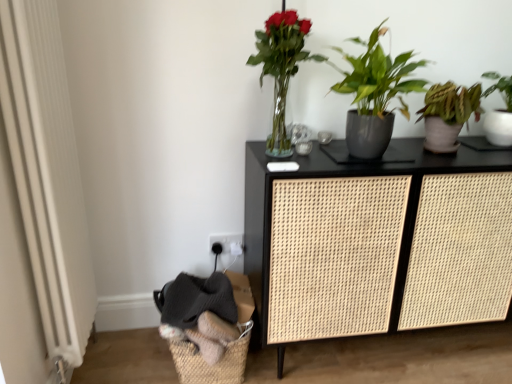
Describe the element at coordinates (47, 172) in the screenshot. I see `white textured radiator at left` at that location.

Locate an element on the screen. The height and width of the screenshot is (384, 512). white textured radiator at left is located at coordinates (47, 172).

What is the approximate height of matte gray pot at center right, which is counted as the 2th houseplant, starting from the left?

The height of matte gray pot at center right, which is counted as the 2th houseplant, starting from the left, is 17.68 inches.

What do you see at coordinates (214, 364) in the screenshot? I see `woven natural basket at lower left` at bounding box center [214, 364].

This screenshot has height=384, width=512. In order to click on black rattan cabinet at center in this screenshot , I will do `click(371, 243)`.

Locate an element on the screen. white textured radiator at left is located at coordinates (47, 172).

Considering the relative positions of translucent glass vase at upper center, which is counted as the third houseplant, starting from the right, and green matte plant at right, which appears as the third houseplant when viewed from the left, in the image provided, is translucent glass vase at upper center, which is counted as the third houseplant, starting from the right, to the right of green matte plant at right, which appears as the third houseplant when viewed from the left, from the viewer's perspective?

No.

Which is behind, translucent glass vase at upper center, which is counted as the third houseplant, starting from the right, or green matte plant at right, positioned as the first houseplant in right-to-left order?

green matte plant at right, positioned as the first houseplant in right-to-left order, is behind.

Considering the sizes of objects white textured radiator at left and woven natural basket at lower left in the image provided, who is bigger, white textured radiator at left or woven natural basket at lower left?

Bigger between the two is white textured radiator at left.

From the image's perspective, between white textured radiator at left and woven natural basket at lower left, who is located below?

woven natural basket at lower left appears lower in the image.

Is white textured radiator at left far away from woven natural basket at lower left?

white textured radiator at left is near woven natural basket at lower left, not far away.

From the image's perspective, is translucent glass vase at upper center, which is counted as the third houseplant, starting from the right, below woven natural basket at lower left?

Incorrect, from the image's perspective, translucent glass vase at upper center, which is counted as the third houseplant, starting from the right, is higher than woven natural basket at lower left.

Looking at the image, does translucent glass vase at upper center, which ranks as the first houseplant in left-to-right order, seem bigger or smaller compared to woven natural basket at lower left?

In the image, translucent glass vase at upper center, which ranks as the first houseplant in left-to-right order, appears to be smaller than woven natural basket at lower left.

Find the location of a particular element. The width and height of the screenshot is (512, 384). basket behind the translucent glass vase at upper center, which ranks as the first houseplant in left-to-right order is located at coordinates (214, 364).

Is translucent glass vase at upper center, which ranks as the first houseplant in left-to-right order, situated inside woven natural basket at lower left or outside?

translucent glass vase at upper center, which ranks as the first houseplant in left-to-right order, exists outside the volume of woven natural basket at lower left.

From a real-world perspective, which is physically below, green matte plant at right, which appears as the third houseplant when viewed from the left, or white textured radiator at left?

white textured radiator at left.

Is green matte plant at right, positioned as the first houseplant in right-to-left order, far from white textured radiator at left?

That's right, there is a large distance between green matte plant at right, positioned as the first houseplant in right-to-left order, and white textured radiator at left.

Is green matte plant at right, positioned as the first houseplant in right-to-left order, facing away from white textured radiator at left?

That's not correct — green matte plant at right, positioned as the first houseplant in right-to-left order, is not looking away from white textured radiator at left.

Considering the positions of objects green matte plant at right, positioned as the first houseplant in right-to-left order, and white textured radiator at left in the image provided, who is in front, green matte plant at right, positioned as the first houseplant in right-to-left order, or white textured radiator at left?

Positioned in front is white textured radiator at left.

From a real-world perspective, is matte gray pot at center right, positioned as the 2th houseplant in right-to-left order, beneath green matte plant at right, which appears as the third houseplant when viewed from the left?

No, from a real-world perspective, matte gray pot at center right, positioned as the 2th houseplant in right-to-left order, is not below green matte plant at right, which appears as the third houseplant when viewed from the left.

Is matte gray pot at center right, positioned as the 2th houseplant in right-to-left order, situated inside green matte plant at right, which appears as the third houseplant when viewed from the left, or outside?

matte gray pot at center right, positioned as the 2th houseplant in right-to-left order, exists outside the volume of green matte plant at right, which appears as the third houseplant when viewed from the left.

Considering the positions of objects matte gray pot at center right, positioned as the 2th houseplant in right-to-left order, and green matte plant at right, which appears as the third houseplant when viewed from the left, in the image provided, who is in front, matte gray pot at center right, positioned as the 2th houseplant in right-to-left order, or green matte plant at right, which appears as the third houseplant when viewed from the left,?

matte gray pot at center right, positioned as the 2th houseplant in right-to-left order, is more forward.

Between matte gray pot at center right, which is counted as the 2th houseplant, starting from the left, and green matte plant at right, positioned as the first houseplant in right-to-left order, which one appears on the right side from the viewer's perspective?

green matte plant at right, positioned as the first houseplant in right-to-left order, is more to the right.

From the image's perspective, starting from the woven natural basket at lower left, which houseplant is the 2nd one above? Please provide its 2D coordinates.

[(499, 111)]

Measure the distance between green matte plant at right, which appears as the third houseplant when viewed from the left, and woven natural basket at lower left.

They are 4.46 feet apart.

Between green matte plant at right, which appears as the third houseplant when viewed from the left, and woven natural basket at lower left, which one has smaller size?

Smaller between the two is green matte plant at right, which appears as the third houseplant when viewed from the left.

From the image's perspective, which one is positioned higher, green matte plant at right, which appears as the third houseplant when viewed from the left, or woven natural basket at lower left?

green matte plant at right, which appears as the third houseplant when viewed from the left.

Between black rattan cabinet at center and woven natural basket at lower left, which one is positioned behind?

woven natural basket at lower left is more distant.

From the picture: Is black rattan cabinet at center with woven natural basket at lower left?

No, black rattan cabinet at center is not touching woven natural basket at lower left.

Identify the location of furniture above the woven natural basket at lower left (from a real-world perspective). The height and width of the screenshot is (384, 512). (371, 243).

In the image, there is a green matte plant at right, which appears as the third houseplant when viewed from the left. At what (x,y) coordinates should I click in order to perform the action: click on houseplant above it (from the image's perspective). Please return your answer as a coordinate pair (x, y). The width and height of the screenshot is (512, 384). Looking at the image, I should click on (281, 68).

There is a woven natural basket at lower left. Identify the location of screen door above it (from a real-world perspective). The height and width of the screenshot is (384, 512). (47, 172).

When comparing their distances from matte gray pot at center right, positioned as the 2th houseplant in right-to-left order, does translucent glass vase at upper center, which ranks as the first houseplant in left-to-right order, or black rattan cabinet at center seem closer?

Based on the image, translucent glass vase at upper center, which ranks as the first houseplant in left-to-right order, appears to be nearer to matte gray pot at center right, positioned as the 2th houseplant in right-to-left order.

Looking at the image, which one is located closer to woven natural basket at lower left, white textured radiator at left or green matte plant at right, positioned as the first houseplant in right-to-left order?

white textured radiator at left is closer to woven natural basket at lower left.

Estimate the real-world distances between objects in this image. Which object is closer to black rattan cabinet at center, matte gray pot at center right, positioned as the 2th houseplant in right-to-left order, or translucent glass vase at upper center, which ranks as the first houseplant in left-to-right order?

matte gray pot at center right, positioned as the 2th houseplant in right-to-left order.

Which object lies further to the anchor point white textured radiator at left, green matte plant at right, which appears as the third houseplant when viewed from the left, or matte gray pot at center right, positioned as the 2th houseplant in right-to-left order?

green matte plant at right, which appears as the third houseplant when viewed from the left, is positioned further to the anchor white textured radiator at left.

Estimate the real-world distances between objects in this image. Which object is closer to white textured radiator at left, matte gray pot at center right, which is counted as the 2th houseplant, starting from the left, or woven natural basket at lower left?

woven natural basket at lower left.

Estimate the real-world distances between objects in this image. Which object is further from matte gray pot at center right, positioned as the 2th houseplant in right-to-left order, green matte plant at right, positioned as the first houseplant in right-to-left order, or woven natural basket at lower left?

woven natural basket at lower left lies further to matte gray pot at center right, positioned as the 2th houseplant in right-to-left order, than the other object.

Which object lies nearer to the anchor point green matte plant at right, which appears as the third houseplant when viewed from the left, white textured radiator at left or translucent glass vase at upper center, which is counted as the third houseplant, starting from the right?

Among the two, translucent glass vase at upper center, which is counted as the third houseplant, starting from the right, is located nearer to green matte plant at right, which appears as the third houseplant when viewed from the left.

Which object lies nearer to the anchor point black rattan cabinet at center, translucent glass vase at upper center, which is counted as the third houseplant, starting from the right, or woven natural basket at lower left?

Based on the image, translucent glass vase at upper center, which is counted as the third houseplant, starting from the right, appears to be nearer to black rattan cabinet at center.

Where is `houseplant between white textured radiator at left and matte gray pot at center right, which is counted as the 2th houseplant, starting from the left, in the horizontal direction`? The width and height of the screenshot is (512, 384). houseplant between white textured radiator at left and matte gray pot at center right, which is counted as the 2th houseplant, starting from the left, in the horizontal direction is located at coordinates (281, 68).

Find the location of a particular element. This screenshot has width=512, height=384. furniture between translucent glass vase at upper center, which is counted as the third houseplant, starting from the right, and woven natural basket at lower left in the up-down direction is located at coordinates [371, 243].

At what (x,y) coordinates should I click in order to perform the action: click on houseplant between green matte plant at right, positioned as the first houseplant in right-to-left order, and black rattan cabinet at center from top to bottom. Please return your answer as a coordinate pair (x, y). The image size is (512, 384). Looking at the image, I should click on click(x=375, y=94).

The height and width of the screenshot is (384, 512). I want to click on houseplant between translucent glass vase at upper center, which is counted as the third houseplant, starting from the right, and green matte plant at right, which appears as the third houseplant when viewed from the left, in the horizontal direction, so click(x=375, y=94).